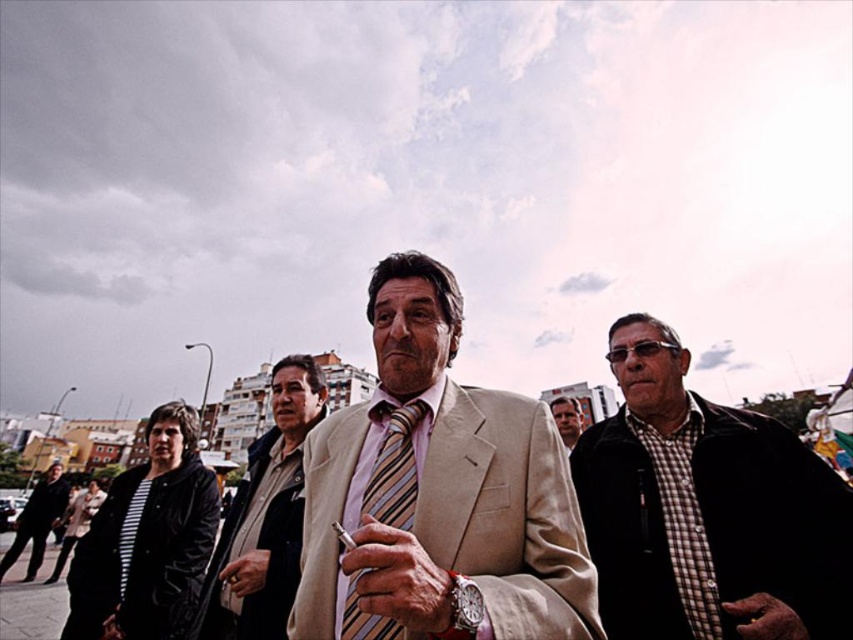
Based on the photo, based on the scene description, which object is bigger in size between the beige fabric suit at center and the striped fabric tie at center?

The beige fabric suit at center is larger in size compared to the striped fabric tie at center according to the description.

You are a photographer trying to capture both the black leather jacket at lower left and the matte silver cigarette at center in a single frame. Given their sizes, which object will require you to adjust your camera to a wider angle to include fully in the shot?

The black leather jacket at lower left is larger in size than the matte silver cigarette at center, so you will need to adjust your camera to a wider angle to fully capture the black leather jacket at lower left in the shot.

You are a photographer trying to capture a closeup of the matte silver cigarette at center without including the black leather jacket at lower left in the frame. Is it possible to do so given their positions?

The black leather jacket at lower left is further to the viewer than the matte silver cigarette at center. Therefore, adjusting the camera angle to focus on the matte silver cigarette at center while excluding the black leather jacket at lower left may be possible since the jacket is closer and can be moved out of the frame by repositioning the camera or zooming in.